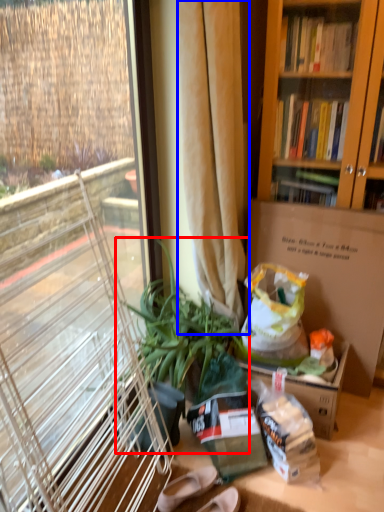
Question: Which point is closer to the camera, houseplant (highlighted by a red box) or curtain (highlighted by a blue box)?

Choices:
 (A) houseplant
 (B) curtain

Answer: (B)